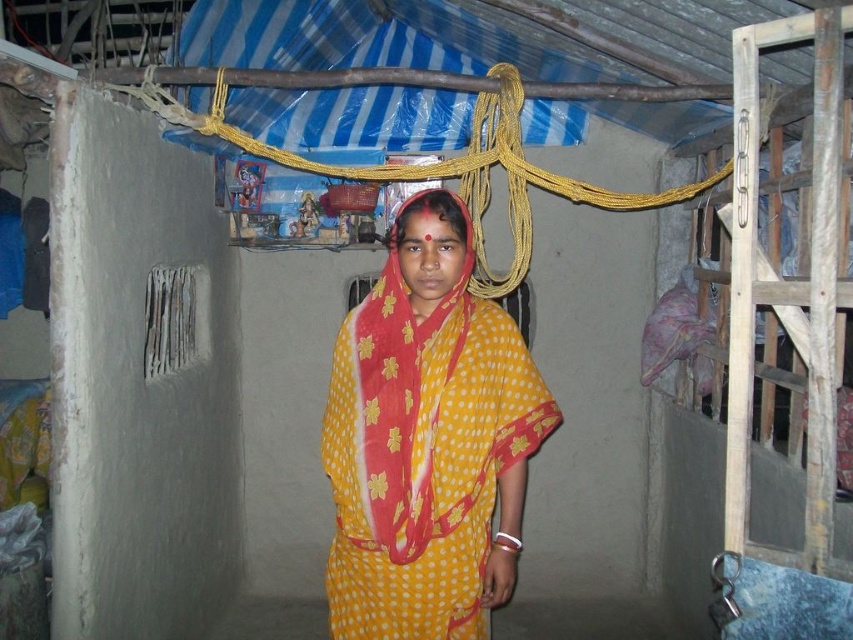
Who is shorter, yellow dotted fabric at center or yellow dotted saree at center?

yellow dotted saree at center

Can you confirm if yellow dotted fabric at center is positioned to the right of yellow dotted saree at center?

Correct, you'll find yellow dotted fabric at center to the right of yellow dotted saree at center.

Does point (334, 461) lie in front of point (421, 204)?

No, (334, 461) is behind (421, 204).

The height and width of the screenshot is (640, 853). What are the coordinates of `yellow dotted fabric at center` in the screenshot? It's located at (427, 442).